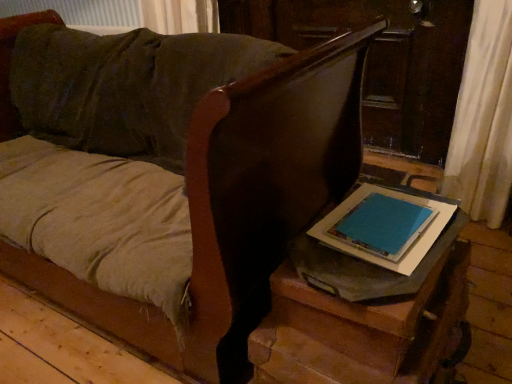
Question: Visually, is blue matte tablet at center positioned to the left or to the right of wooden side table at lower right?

Choices:
 (A) right
 (B) left

Answer: (A)

Question: Which is correct: blue matte tablet at center is inside wooden side table at lower right, or outside of it?

Choices:
 (A) outside
 (B) inside

Answer: (A)

Question: Considering the real-world distances, which object is closest to the blue matte tablet at center?

Choices:
 (A) wooden side table at lower right
 (B) matte gray table at lower right

Answer: (B)

Question: Estimate the real-world distances between objects in this image. Which object is farther from the matte gray table at lower right?

Choices:
 (A) wooden side table at lower right
 (B) blue matte tablet at center

Answer: (A)